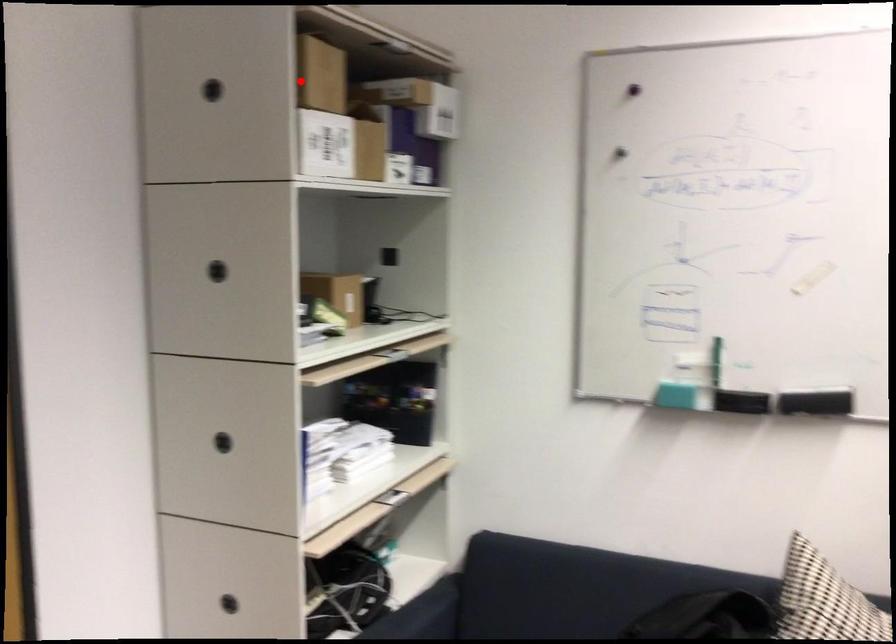
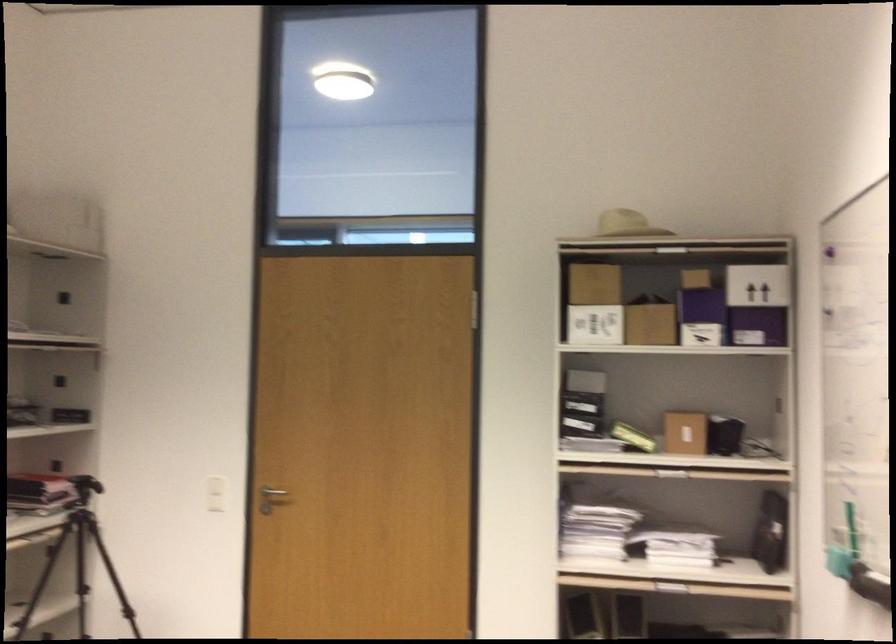
Find the pixel in the second image that matches the highlighted location in the first image.

(592, 283)